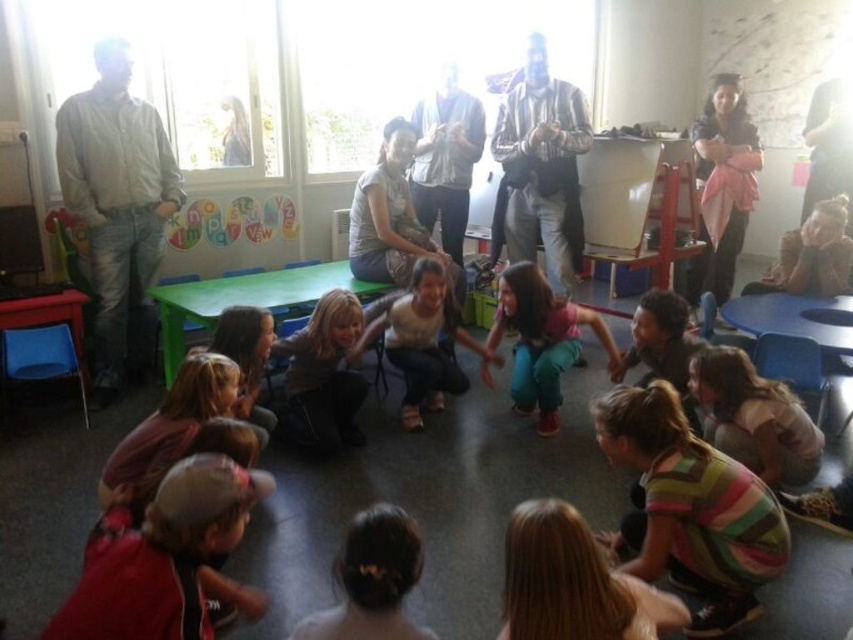
Does dark brown hair bun at center have a smaller size compared to striped shirt at lower right?

Correct, dark brown hair bun at center occupies less space than striped shirt at lower right.

Can you confirm if dark brown hair bun at center is taller than striped shirt at lower right?

In fact, dark brown hair bun at center may be shorter than striped shirt at lower right.

The image size is (853, 640). Find the location of `dark brown hair bun at center`. dark brown hair bun at center is located at coordinates (372, 579).

Can you confirm if dark brown hair bun at center is bigger than light brown hair at center?

Incorrect, dark brown hair bun at center is not larger than light brown hair at center.

Can you confirm if dark brown hair bun at center is positioned to the left of light brown hair at center?

In fact, dark brown hair bun at center is to the right of light brown hair at center.

This screenshot has height=640, width=853. Describe the element at coordinates (372, 579) in the screenshot. I see `dark brown hair bun at center` at that location.

Where is `dark brown hair bun at center`? This screenshot has height=640, width=853. dark brown hair bun at center is located at coordinates (372, 579).

Does striped fabric shirt at center appear on the right side of light brown hair at center?

Correct, you'll find striped fabric shirt at center to the right of light brown hair at center.

Is striped fabric shirt at center closer to the viewer compared to light brown hair at center?

No, striped fabric shirt at center is further to the viewer.

Between point (550, 138) and point (338, 336), which one is positioned in front?

Positioned in front is point (338, 336).

I want to click on striped fabric shirt at center, so click(x=541, y=168).